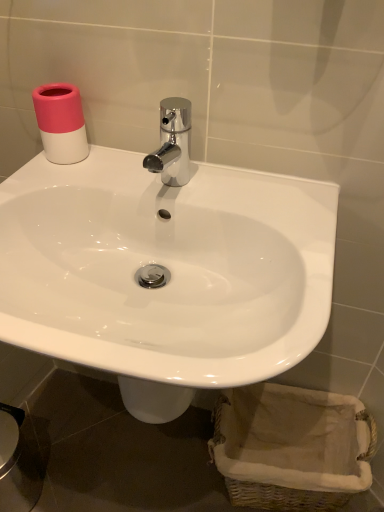
Image resolution: width=384 pixels, height=512 pixels. Identify the location of unoccupied region to the right of pink matte toilet paper at upper left. (139, 168).